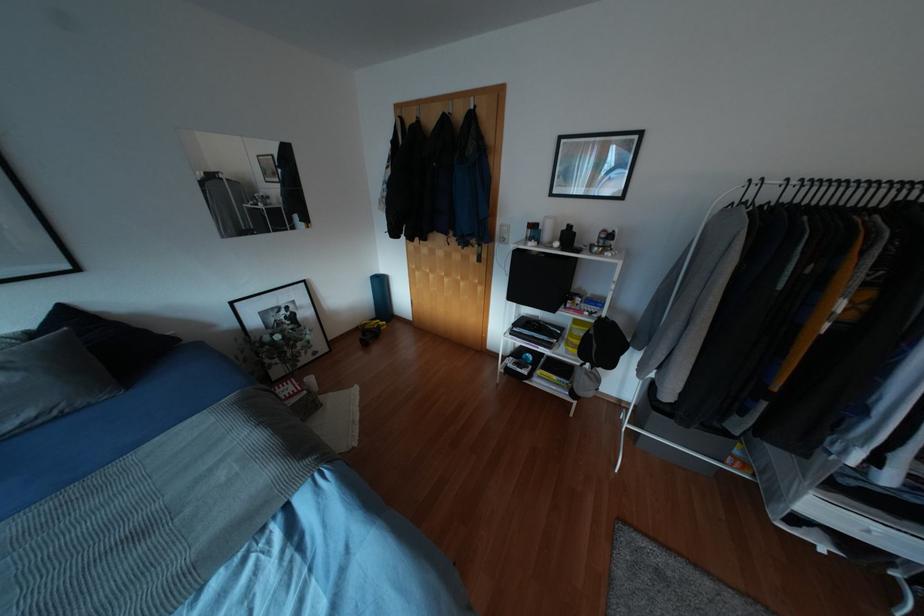
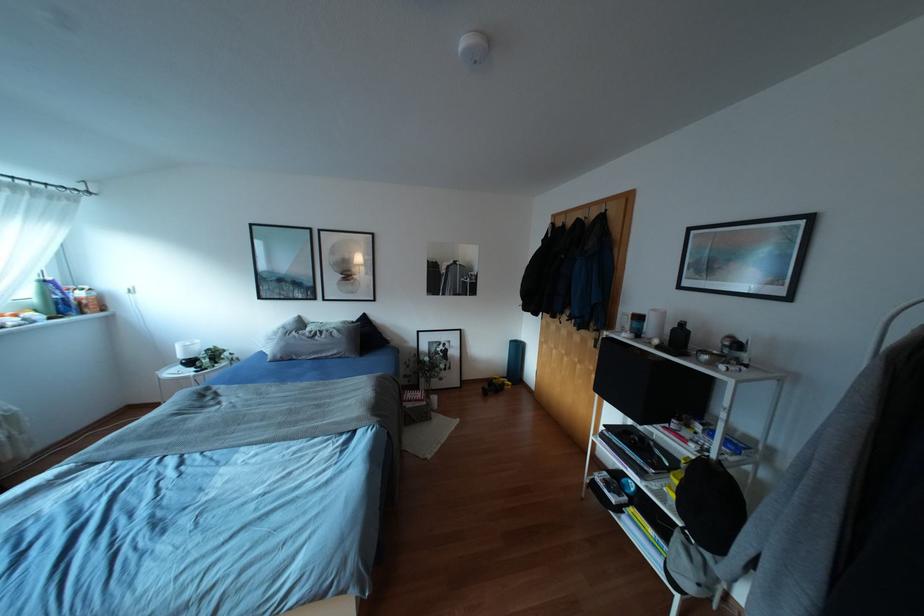
Find the pixel in the second image that matches (x=481, y=111) in the first image.

(612, 214)